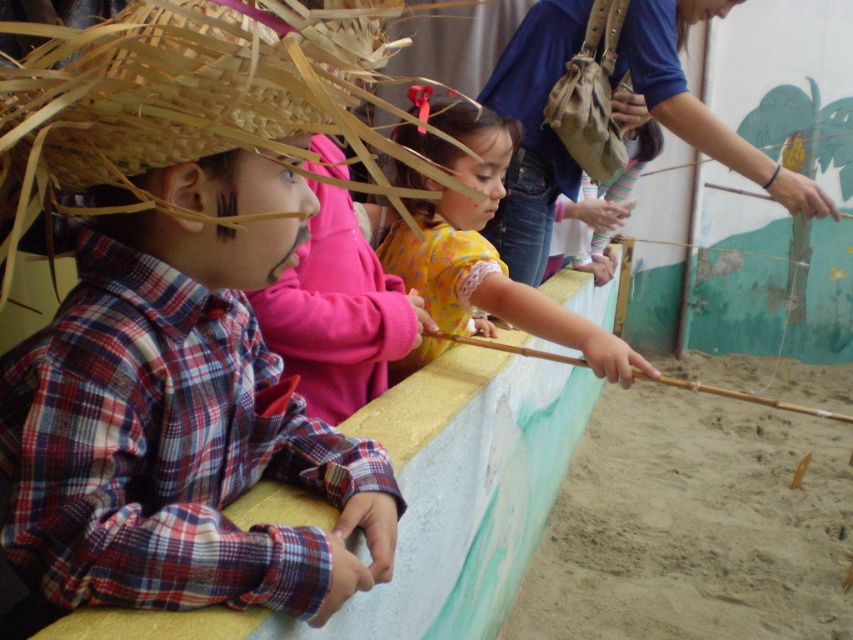
Can you confirm if plaid fabric shirt at left is positioned above yellow matte dress at center?

No, plaid fabric shirt at left is not above yellow matte dress at center.

Who is lower down, plaid fabric shirt at left or yellow matte dress at center?

plaid fabric shirt at left is below.

Is point (350, 586) in front of point (428, 273)?

Yes, point (350, 586) is closer to viewer.

Image resolution: width=853 pixels, height=640 pixels. I want to click on plaid fabric shirt at left, so click(x=181, y=413).

Can you confirm if fine-grained sand at lower right is taller than brown wooden stick at center?

Correct, fine-grained sand at lower right is much taller as brown wooden stick at center.

Does fine-grained sand at lower right have a lesser width compared to brown wooden stick at center?

In fact, fine-grained sand at lower right might be wider than brown wooden stick at center.

Between point (595, 515) and point (704, 388), which one is positioned behind?

Point (595, 515)

This screenshot has width=853, height=640. In order to click on fine-grained sand at lower right in this screenshot , I will do `click(693, 525)`.

Between yellow matte dress at center and brown wooden stick at center, which one appears on the left side from the viewer's perspective?

Positioned to the left is yellow matte dress at center.

Identify the location of yellow matte dress at center. Image resolution: width=853 pixels, height=640 pixels. (480, 240).